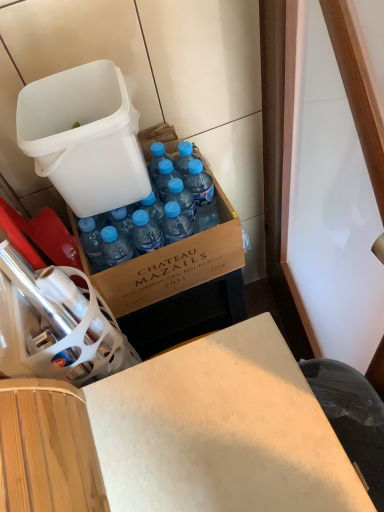
Question: Are blue plastic bottle at center and white plastic trash can at upper left making contact?

Choices:
 (A) yes
 (B) no

Answer: (B)

Question: Can you confirm if blue plastic bottle at center is shorter than white plastic trash can at upper left?

Choices:
 (A) no
 (B) yes

Answer: (A)

Question: Does blue plastic bottle at center have a larger size compared to white plastic trash can at upper left?

Choices:
 (A) no
 (B) yes

Answer: (A)

Question: Is blue plastic bottle at center not within white plastic trash can at upper left?

Choices:
 (A) no
 (B) yes

Answer: (B)

Question: Does blue plastic bottle at center have a lesser width compared to white plastic trash can at upper left?

Choices:
 (A) yes
 (B) no

Answer: (A)

Question: Can you confirm if blue plastic bottle at center is taller than white plastic trash can at upper left?

Choices:
 (A) no
 (B) yes

Answer: (B)

Question: Could you tell me if wooden desk at center is facing white plastic trash can at upper left?

Choices:
 (A) yes
 (B) no

Answer: (B)

Question: From a real-world perspective, does wooden desk at center stand above white plastic trash can at upper left?

Choices:
 (A) yes
 (B) no

Answer: (B)

Question: Can you confirm if wooden desk at center is positioned to the left of white plastic trash can at upper left?

Choices:
 (A) no
 (B) yes

Answer: (A)

Question: From the image's perspective, is wooden desk at center under white plastic trash can at upper left?

Choices:
 (A) no
 (B) yes

Answer: (B)

Question: Is wooden desk at center located outside white plastic trash can at upper left?

Choices:
 (A) yes
 (B) no

Answer: (A)

Question: Is wooden desk at center oriented away from white plastic trash can at upper left?

Choices:
 (A) no
 (B) yes

Answer: (A)

Question: Does white plastic trash can at upper left appear on the left side of blue plastic bottle at center?

Choices:
 (A) yes
 (B) no

Answer: (A)